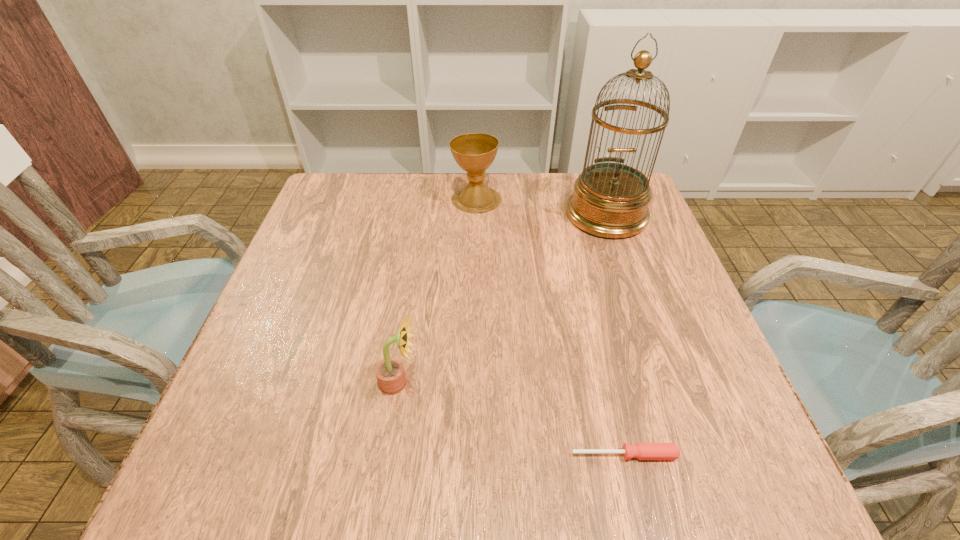
Find the location of a particular element. The width and height of the screenshot is (960, 540). birdcage that is positioned at the far edge is located at coordinates (610, 200).

Locate an element on the screen. chalice positioned at the far edge is located at coordinates (474, 152).

The image size is (960, 540). Identify the location of object positioned at the near edge. (643, 451).

This screenshot has height=540, width=960. I want to click on birdcage present at the right edge, so click(x=610, y=200).

At what (x,y) coordinates should I click in order to perform the action: click on screwdriver positioned at the right edge. Please return your answer as a coordinate pair (x, y). This screenshot has width=960, height=540. Looking at the image, I should click on (643, 451).

Where is `object at the far right corner`? object at the far right corner is located at coordinates (610, 200).

The height and width of the screenshot is (540, 960). Find the location of `object that is at the near right corner`. object that is at the near right corner is located at coordinates (643, 451).

In the image, there is a desktop. Find the location of `vacant region at the far edge`. vacant region at the far edge is located at coordinates 465,218.

You are a GUI agent. You are given a task and a screenshot of the screen. Output one action in this format:
    pyautogui.click(x=<x>, y=<y>)
    Task: Click on the free region at the near edge of the desktop
    This screenshot has width=960, height=540.
    Given the screenshot: What is the action you would take?
    pyautogui.click(x=637, y=496)

In the image, there is a desktop. Where is `vacant space at the left edge`? This screenshot has height=540, width=960. vacant space at the left edge is located at coordinates (328, 297).